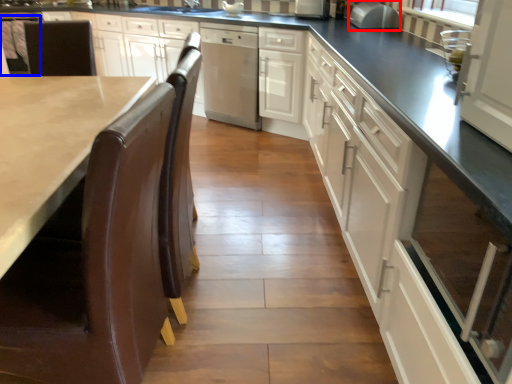
Question: Which object is closer to the camera taking this photo, appliance (highlighted by a red box) or chair (highlighted by a blue box)?

Choices:
 (A) appliance
 (B) chair

Answer: (A)